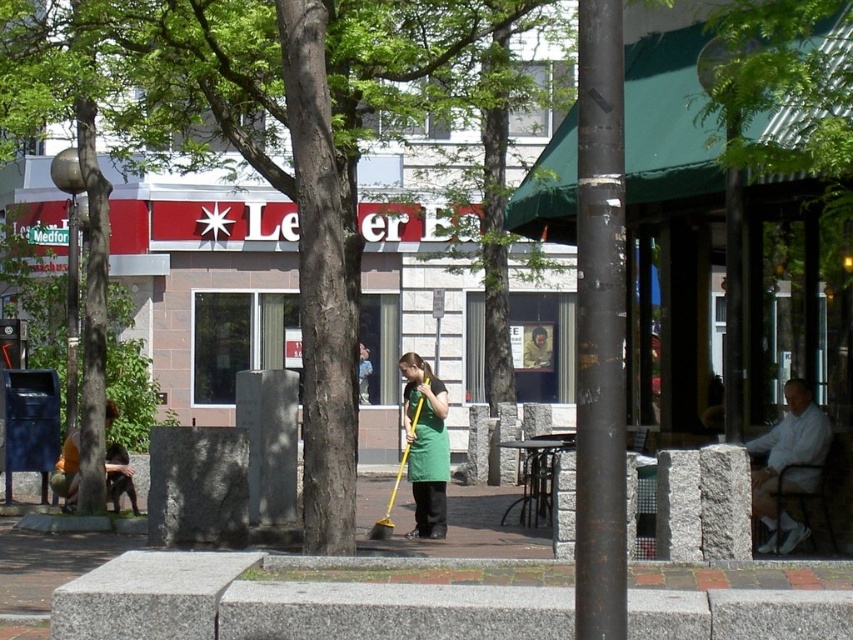
Question: Does green fabric apron at center appear under orange shirt at lower left?

Choices:
 (A) yes
 (B) no

Answer: (B)

Question: Which object is positioned closest to the green leafy tree at center?

Choices:
 (A) orange shirt at lower left
 (B) white cotton shirt at right
 (C) green fabric apron at center
 (D) rusty metal pole at center

Answer: (A)

Question: Is green leafy tree at center wider than orange shirt at lower left?

Choices:
 (A) yes
 (B) no

Answer: (A)

Question: Which object is positioned farthest from the green fabric apron at center?

Choices:
 (A) white cotton shirt at right
 (B) green leafy tree at center
 (C) rusty metal pole at center

Answer: (C)

Question: Does green leafy tree at center appear under rusty metal pole at center?

Choices:
 (A) yes
 (B) no

Answer: (B)

Question: Which of the following is the farthest from the observer?

Choices:
 (A) orange shirt at lower left
 (B) rusty metal pole at center

Answer: (A)